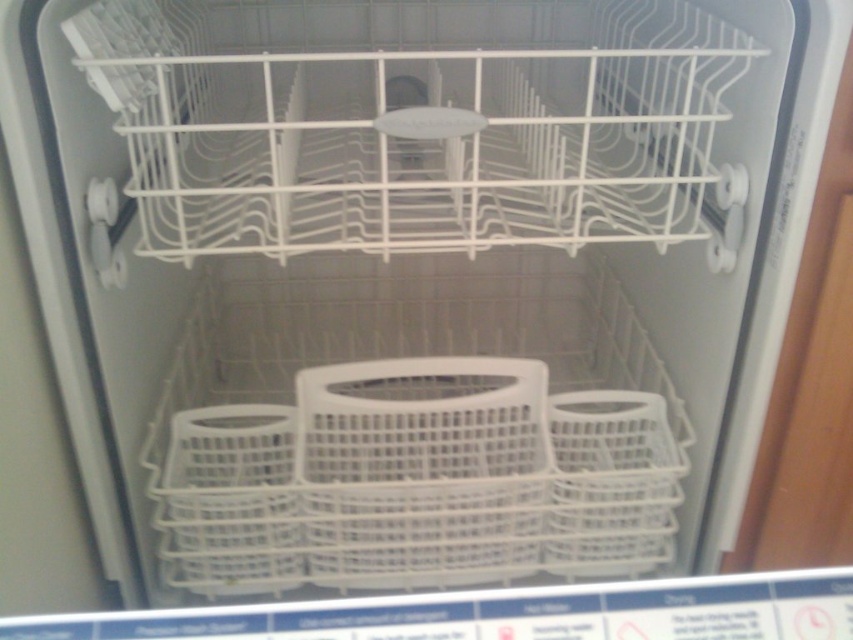
Who is more forward, (418, 474) or (238, 570)?

Point (238, 570) is more forward.

Who is lower down, white plastic basket at center or white plastic basket at lower left?

white plastic basket at lower left

Is point (303, 456) positioned behind point (279, 461)?

That is False.

Locate an element on the screen. white plastic basket at center is located at coordinates (422, 474).